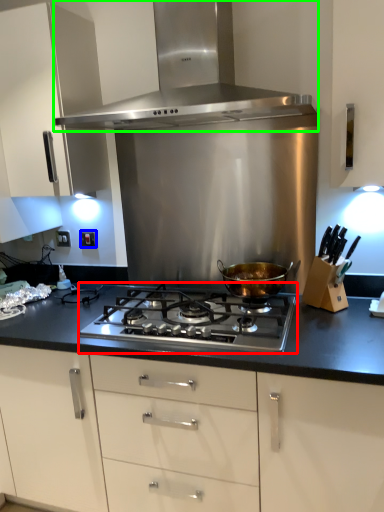
Question: Which object is the closest to the gas stove (highlighted by a red box)? Choose among these: electric outlet (highlighted by a blue box) or kitchen appliance (highlighted by a green box).

Choices:
 (A) electric outlet
 (B) kitchen appliance

Answer: (B)